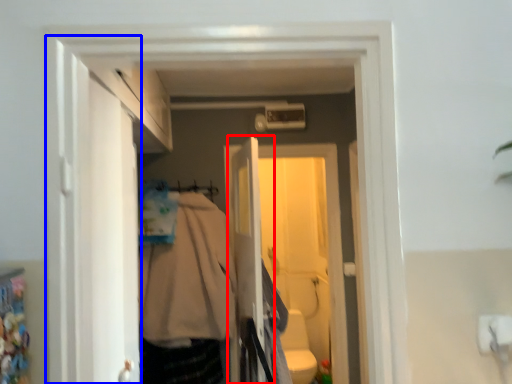
Question: Which of the following is the farthest to the observer, screen door (highlighted by a red box) or door (highlighted by a blue box)?

Choices:
 (A) screen door
 (B) door

Answer: (A)